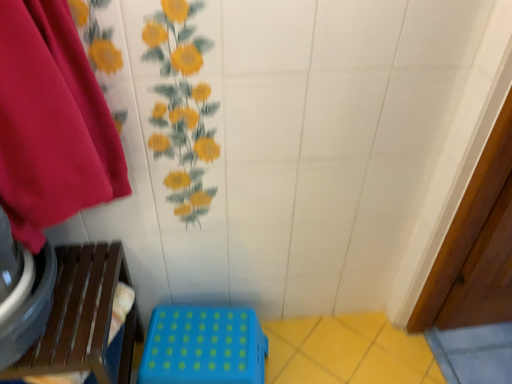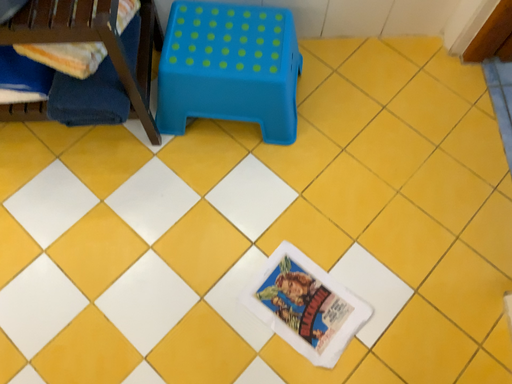
Question: How did the camera likely rotate when shooting the video?

Choices:
 (A) rotated upward
 (B) rotated downward

Answer: (B)